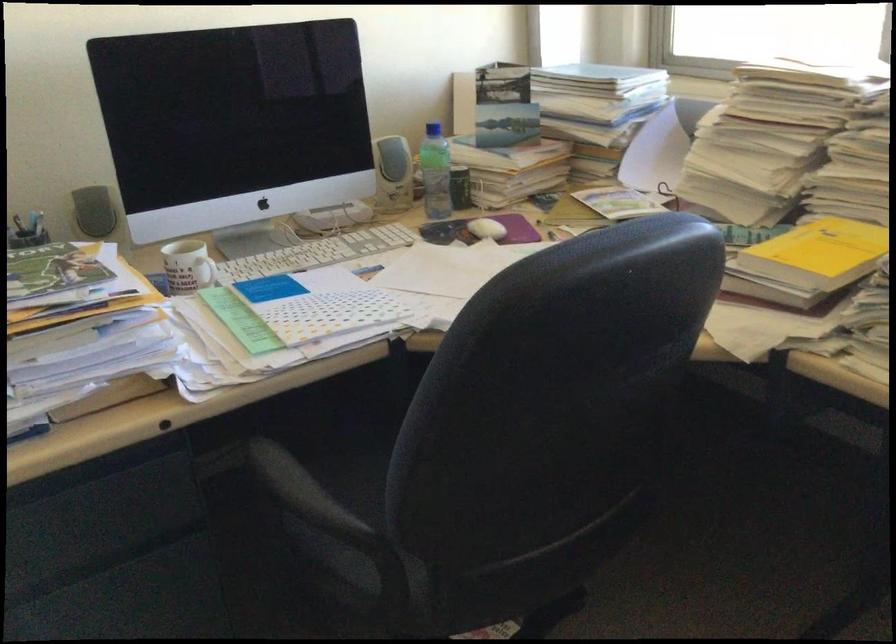
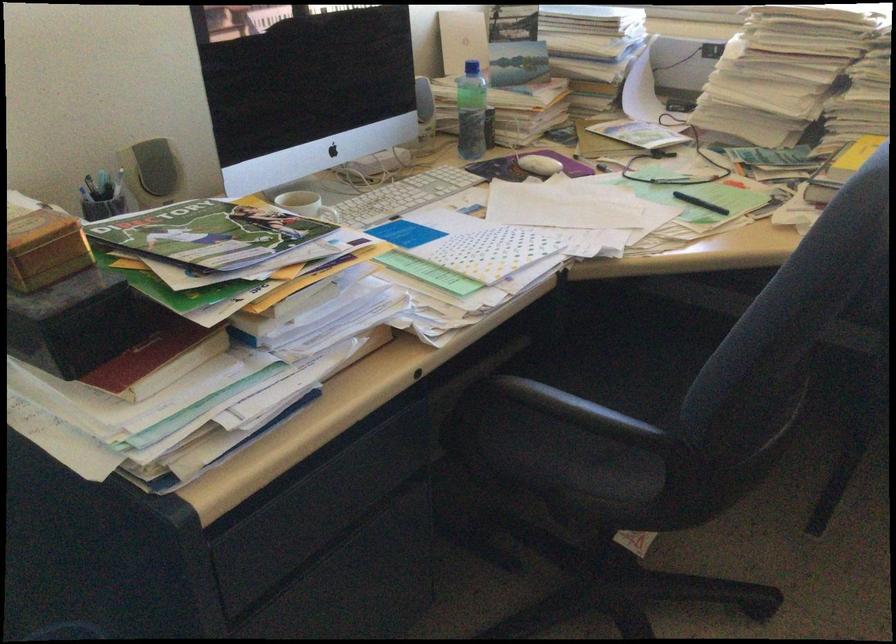
Locate, in the second image, the point that corresponds to pixel 245 263 in the first image.

(334, 216)